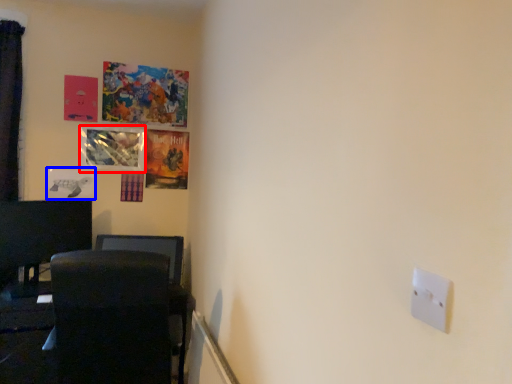
Question: Which object appears farthest to the camera in this image, picture frame (highlighted by a red box) or picture frame (highlighted by a blue box)?

Choices:
 (A) picture frame
 (B) picture frame

Answer: (A)